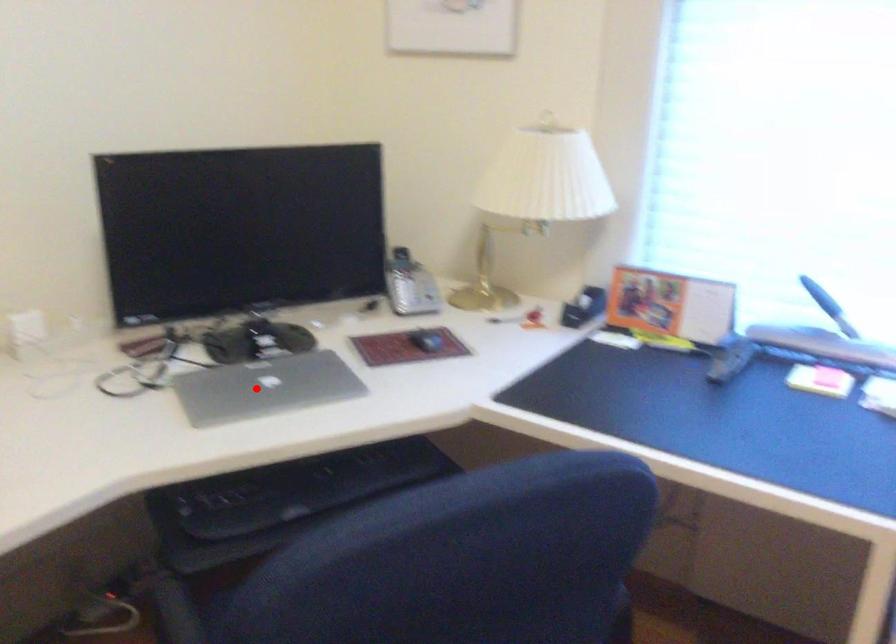
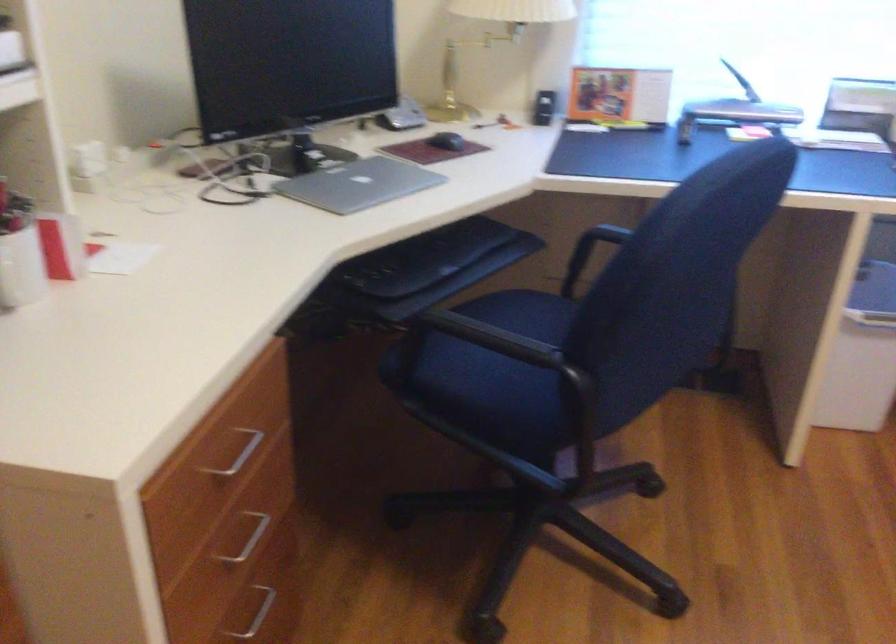
Question: I am providing you with two images of the same scene from different viewpoints. A red point is marked on the first image. Is the red point's position out of view in image 2?

Choices:
 (A) Yes
 (B) No

Answer: (B)